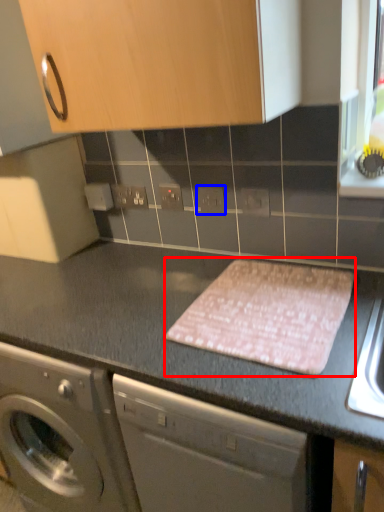
Question: Among these objects, which one is farthest to the camera, blanket (highlighted by a red box) or electric outlet (highlighted by a blue box)?

Choices:
 (A) blanket
 (B) electric outlet

Answer: (B)